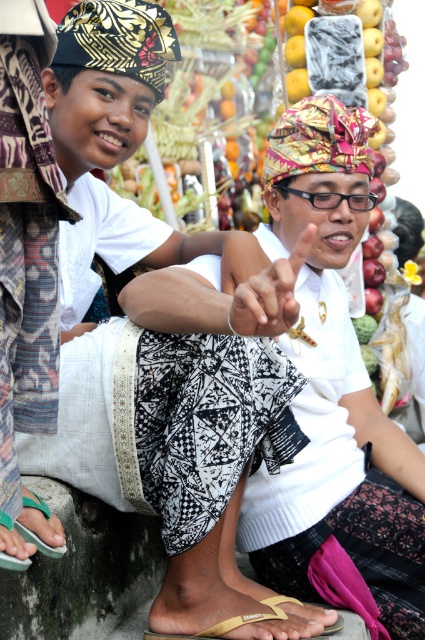
Who is more forward, (x=220, y=634) or (x=285, y=596)?

Point (x=220, y=634) is in front.

Is point (200, 634) in front of point (265, 604)?

That is True.

You are a GUI agent. You are given a task and a screenshot of the screen. Output one action in this format:
    pyautogui.click(x=<x>, y=<y>)
    Task: Click on the yellow fabric sandal at lower center
    The height and width of the screenshot is (640, 425).
    Given the screenshot: What is the action you would take?
    pyautogui.click(x=232, y=620)

Does green flip-flop at lower left appear on the left side of yellow fabric sandal at lower center?

Yes, green flip-flop at lower left is to the left of yellow fabric sandal at lower center.

This screenshot has width=425, height=640. Describe the element at coordinates (30, 532) in the screenshot. I see `green flip-flop at lower left` at that location.

Locate an element on the screen. green flip-flop at lower left is located at coordinates (30, 532).

Can you confirm if green flip-flop at lower left is positioned to the right of gold textured sandal at lower center?

In fact, green flip-flop at lower left is to the left of gold textured sandal at lower center.

What do you see at coordinates (30, 532) in the screenshot? The image size is (425, 640). I see `green flip-flop at lower left` at bounding box center [30, 532].

I want to click on green flip-flop at lower left, so click(30, 532).